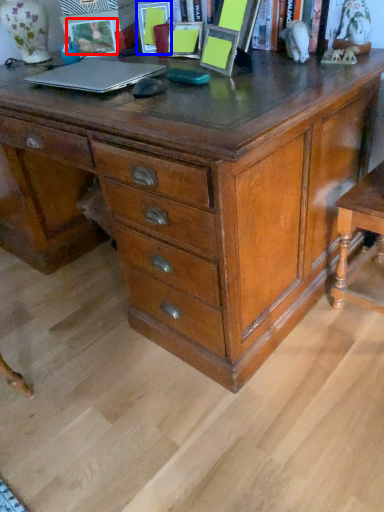
Question: Which point is further to the camera, picture frame (highlighted by a red box) or picture frame (highlighted by a blue box)?

Choices:
 (A) picture frame
 (B) picture frame

Answer: (A)